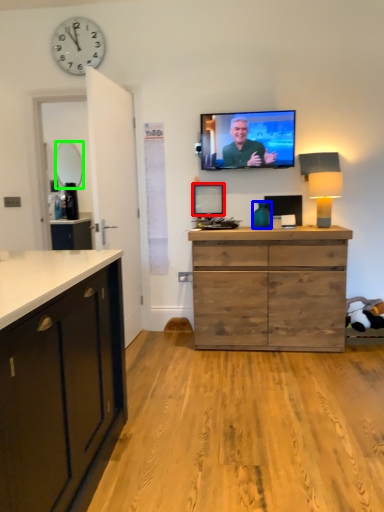
Question: Which object is the closest to the picture frame (highlighted by a red box)? Choose among these: vase (highlighted by a blue box) or mirror (highlighted by a green box).

Choices:
 (A) vase
 (B) mirror

Answer: (A)